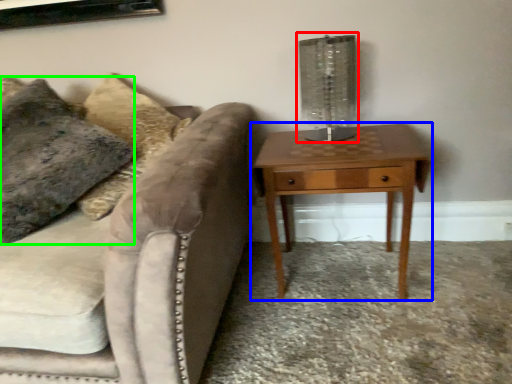
Question: Which object is positioned farthest from table lamp (highlighted by a red box)? Select from nightstand (highlighted by a blue box) and pillow (highlighted by a green box).

Choices:
 (A) nightstand
 (B) pillow

Answer: (B)